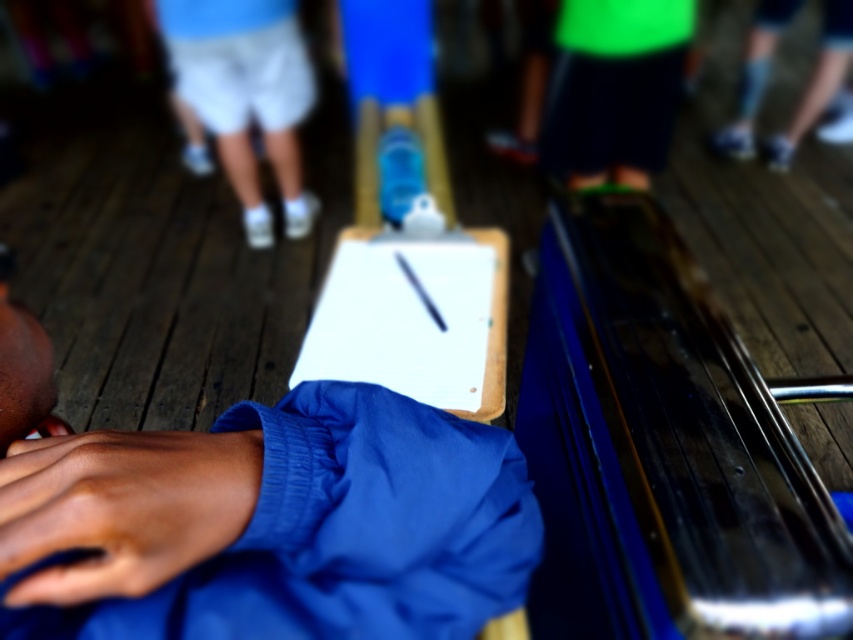
You are an event organizer trying to set up a photo backdrop. You have two items in front of you, the blue fabric shirt at center and the white cotton shorts at upper center. Which item should you place higher on the backdrop to ensure it appears larger in the final photo?

The blue fabric shirt at center is not as tall as the white cotton shorts at upper center, so to make it appear larger in the photo, you should place the blue fabric shirt at center higher on the backdrop.

You are a photographer at the event and want to capture a closeup of the dark skin hand at lower left. What are the coordinates where you should focus your camera?

The dark skin hand at lower left is located at coordinates point [120,508].

You are standing at the point with coordinates point (440, 394) and want to throw a ball to someone standing at point (134, 529). Considering the perspective of the image, will the ball travel towards the camera or away from it?

The ball will travel towards the camera because point (134, 529) is closer to the camera than point (440, 394) according to the coordinates provided.